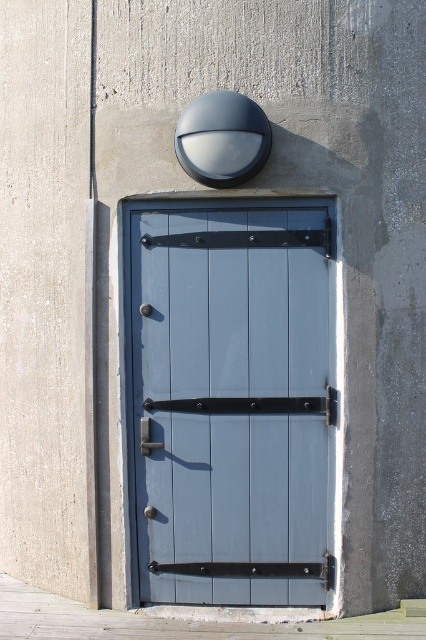
Question: Does matte wood door at center have a larger size compared to matte silver handle at center?

Choices:
 (A) yes
 (B) no

Answer: (A)

Question: Which object appears farthest from the camera in this image?

Choices:
 (A) matte wood door at center
 (B) matte silver handle at center

Answer: (B)

Question: Can you confirm if matte wood door at center is positioned to the right of matte silver handle at center?

Choices:
 (A) no
 (B) yes

Answer: (B)

Question: Which point is closer to the camera taking this photo?

Choices:
 (A) coord(143,444)
 (B) coord(158,214)

Answer: (B)

Question: Can you confirm if matte wood door at center is smaller than matte silver handle at center?

Choices:
 (A) no
 (B) yes

Answer: (A)